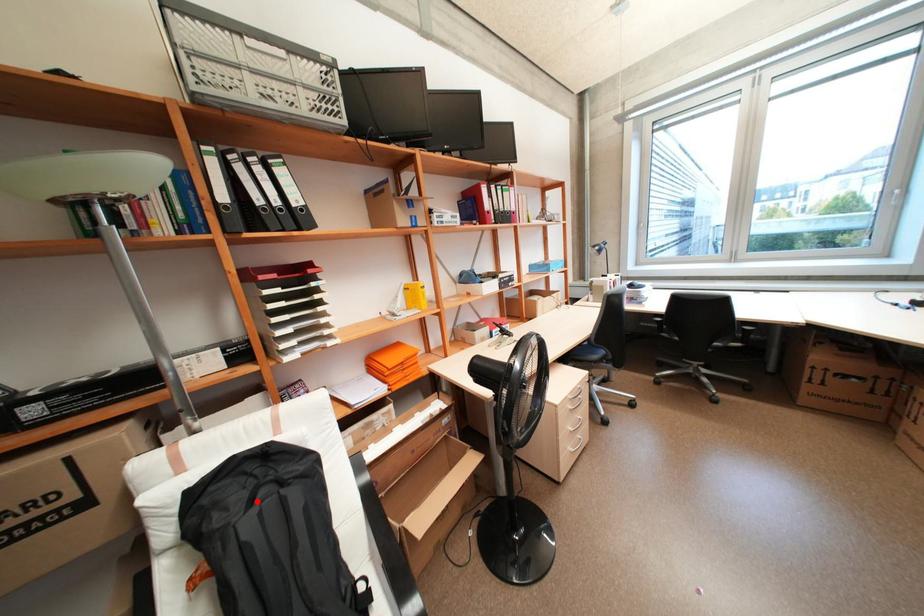
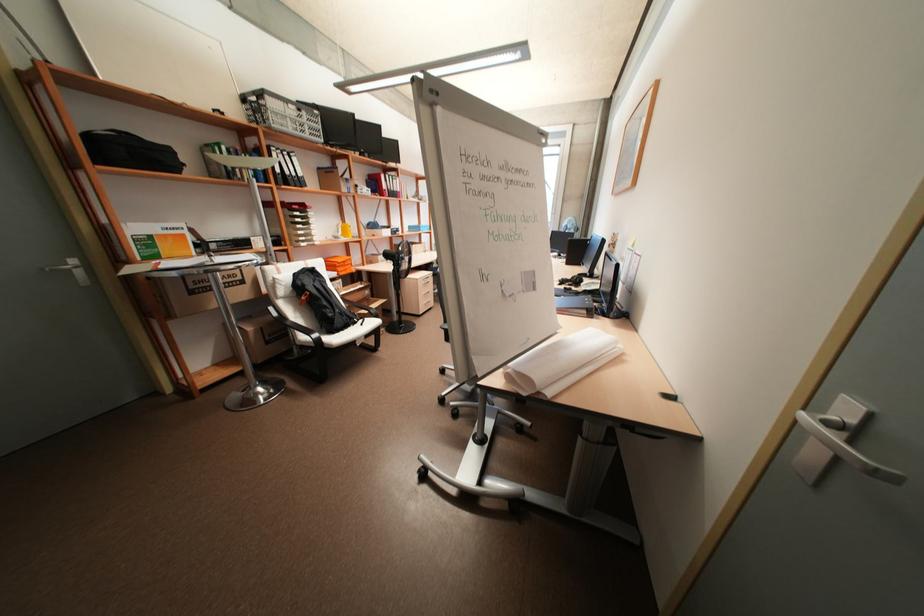
Question: I am providing you with two images of the same scene from different viewpoints. Image1 has a red point marked. In image2, the corresponding 3D location appears at what relative position? Reply with the corresponding letter.

Choices:
 (A) Closer
 (B) Farther

Answer: (A)